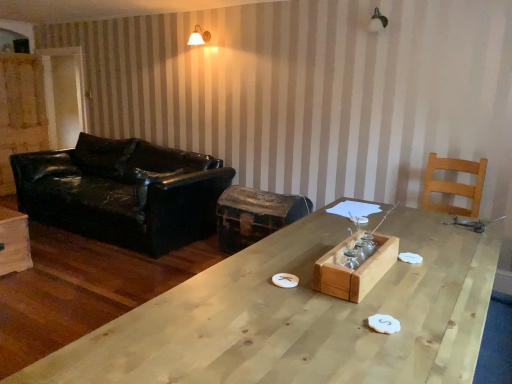
Identify the location of free point above natural wood table at center (from a real-world perspective). This screenshot has width=512, height=384. (305, 299).